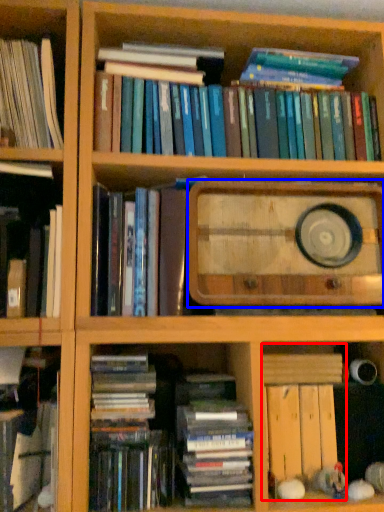
Question: Among these objects, which one is nearest to the camera, book (highlighted by a red box) or paperback book (highlighted by a blue box)?

Choices:
 (A) book
 (B) paperback book

Answer: (B)